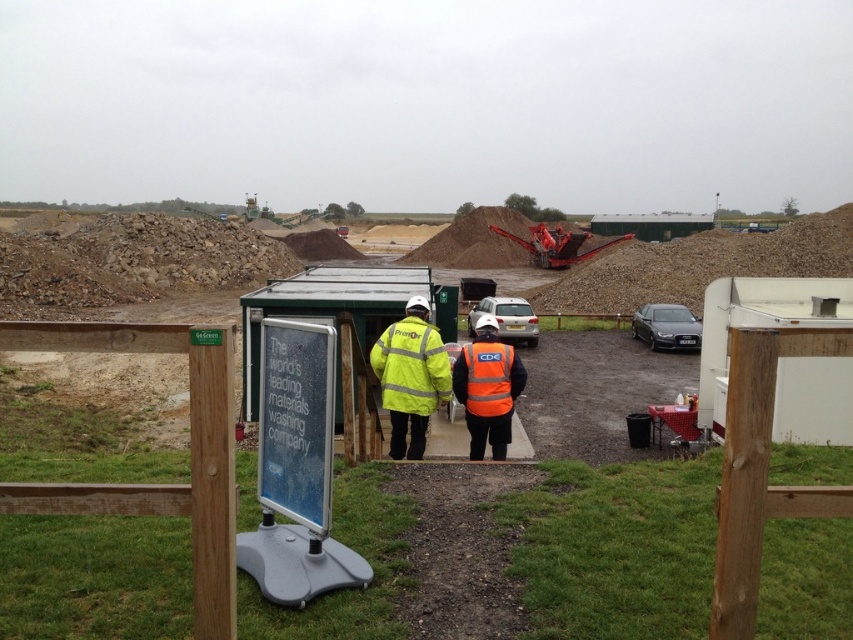
Does reflective yellow vest at center appear under metallic red machinery at center?

Yes.

Does reflective yellow vest at center appear on the left side of metallic red machinery at center?

Correct, you'll find reflective yellow vest at center to the left of metallic red machinery at center.

Who is more distant from viewer, (532,388) or (596,248)?

The point (596,248) is more distant.

Identify the location of reflective yellow vest at center. This screenshot has height=640, width=853. (106, 337).

Is point (473, 444) positioned in front of point (45, 330)?

No.

Can you confirm if orange reflective vest at center is positioned above reflective yellow vest at center?

Actually, orange reflective vest at center is below reflective yellow vest at center.

Identify the location of orange reflective vest at center. The width and height of the screenshot is (853, 640). (486, 388).

Is high-visibility yellow jacket at center further to camera compared to reflective yellow vest at center?

Yes, it is behind reflective yellow vest at center.

Does high-visibility yellow jacket at center have a lesser height compared to reflective yellow vest at center?

Yes, high-visibility yellow jacket at center is shorter than reflective yellow vest at center.

Between point (440, 353) and point (384, 528), which one is positioned behind?

Point (440, 353)

Locate an element on the screen. high-visibility yellow jacket at center is located at coordinates (410, 376).